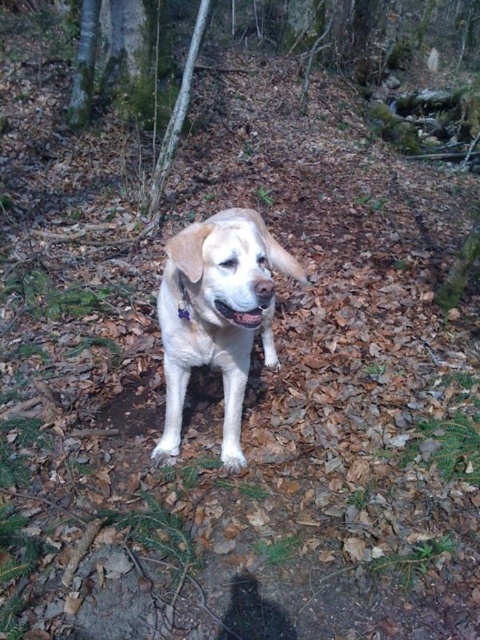
You are a photographer trying to capture a closeup of the white fur dog at center and the pink glossy tongue at center. Which object should you zoom in on to ensure both are in focus without moving the camera?

The white fur dog at center is wider than the pink glossy tongue at center, so you should zoom in on the white fur dog at center to ensure both are in focus without moving the camera.

You are standing in a forest and see two points marked in the image. Which point is closer to you, point (230, 228) or point (252, 312)?

Point (230, 228) is closer to you than point (252, 312).

Looking at this image, you are standing in a forest and see the point at coordinates [251,292]. If you want to place a small snack for a dog that is 2 feet wide, can you determine if the space between you and that point is wide enough for the dog to pass through?

The distance between you and the point at coordinates [251,292] is 4.70 feet. Since the dog is 2 feet wide, the space is wide enough for the dog to pass through.